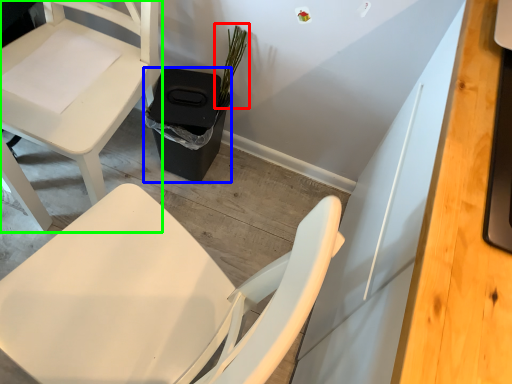
Question: Which object is the farthest from plant (highlighted by a red box)? Choose among these: trash bin/can (highlighted by a blue box) or chair (highlighted by a green box).

Choices:
 (A) trash bin/can
 (B) chair

Answer: (B)